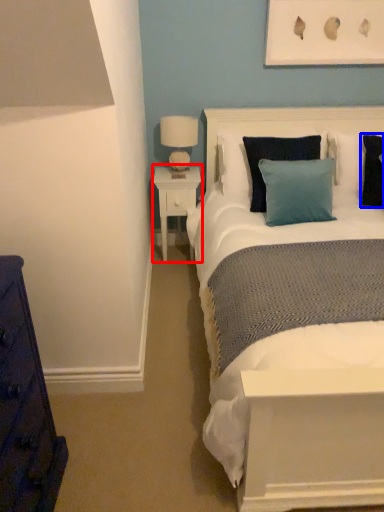
Question: Among these objects, which one is nearest to the camera, nightstand (highlighted by a red box) or pillow (highlighted by a blue box)?

Choices:
 (A) nightstand
 (B) pillow

Answer: (B)